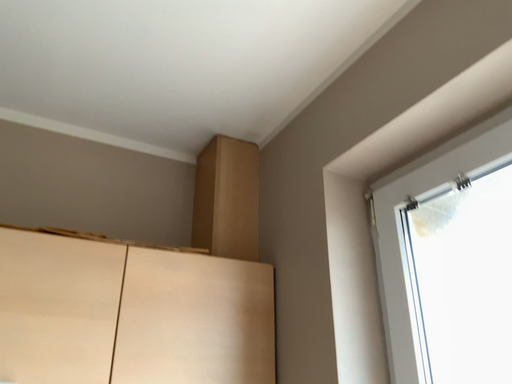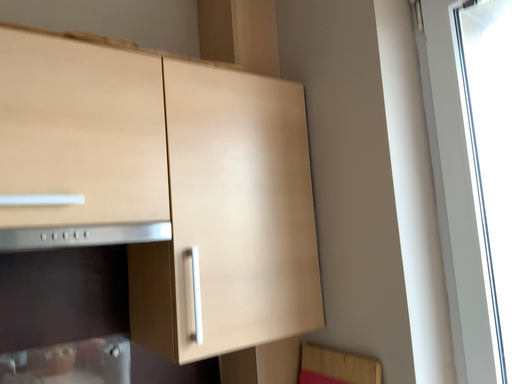
Question: Which way did the camera rotate in the video?

Choices:
 (A) rotated downward
 (B) rotated upward

Answer: (A)